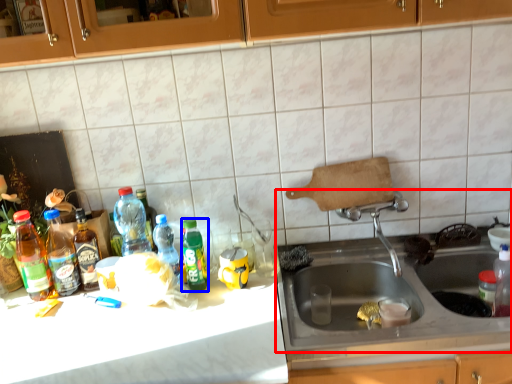
Question: Which point is further to the camera, sink (highlighted by a red box) or bottle (highlighted by a blue box)?

Choices:
 (A) sink
 (B) bottle

Answer: (B)